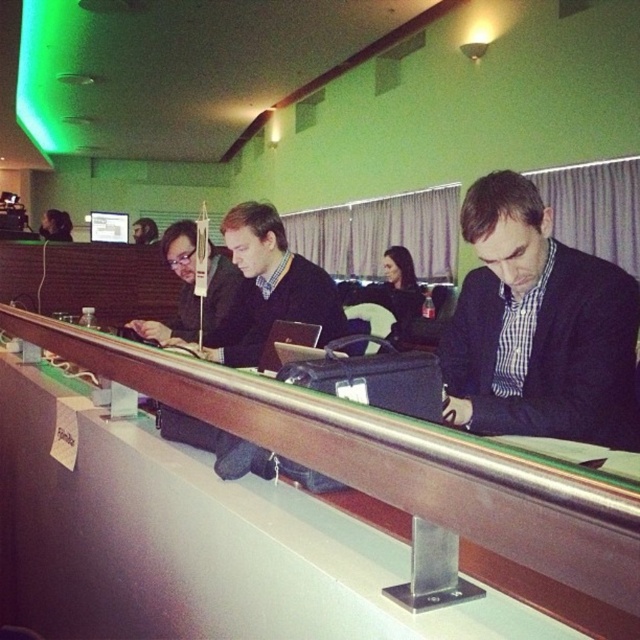
You are a guest entering the conference room and want to sit at the wooden table at center. Where should you place your black fabric jacket at center so it doesn not obstruct the table?

The wooden table at center is below the black fabric jacket at center, so you should place your black fabric jacket at center above the table to avoid blocking it.

You are organizing a meeting in this conference room and need to seat additional guests. Given the presence of the black matte suit at center and the wooden table at center, which object would allow more space for seating adjustments?

The wooden table at center occupies more space than the black matte suit at center, so seating adjustments can be made around the wooden table at center.

You are organizing a formal event and need to seat two guests wearing the black matte suit at center and the black fabric jacket at center at the long wooden table. Given their clothing, which guest should be seated closer to the entrance to ensure proper spacing?

The black matte suit at center should be seated closer to the entrance because its width is less than the black fabric jacket at center, allowing for more space between them and other guests.